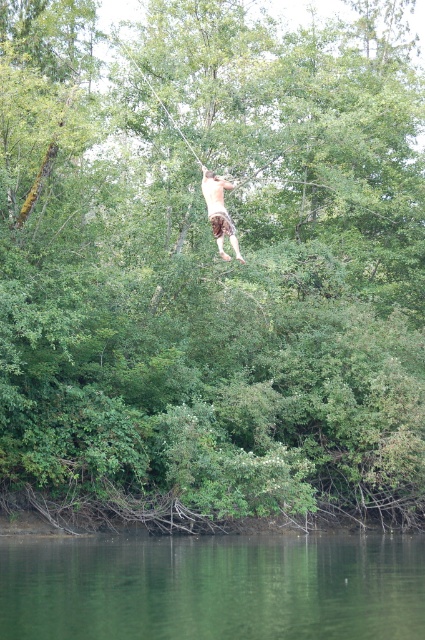
Question: Among these points, which one is nearest to the camera?

Choices:
 (A) (303, 561)
 (B) (170, 116)
 (C) (221, 200)

Answer: (C)

Question: Does green smooth water at lower center lie in front of brown textured shorts at center?

Choices:
 (A) yes
 (B) no

Answer: (A)

Question: Which object is closer to the camera taking this photo?

Choices:
 (A) white rope at upper center
 (B) green smooth water at lower center

Answer: (B)

Question: Does green smooth water at lower center come in front of white rope at upper center?

Choices:
 (A) no
 (B) yes

Answer: (B)

Question: Can you confirm if brown textured shorts at center is smaller than white rope at upper center?

Choices:
 (A) yes
 (B) no

Answer: (A)

Question: Which object is farther from the camera taking this photo?

Choices:
 (A) white rope at upper center
 (B) brown textured shorts at center
 (C) green smooth water at lower center

Answer: (A)